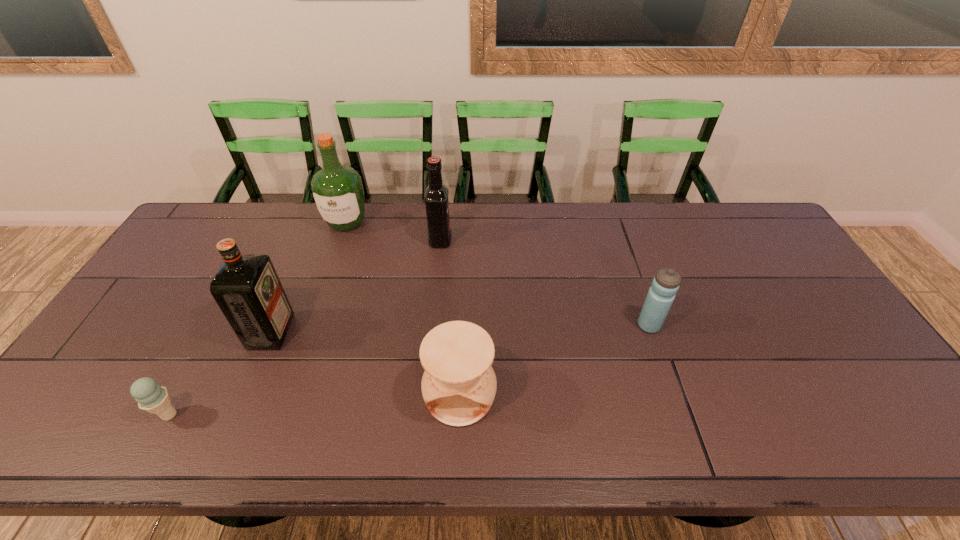
You are a GUI agent. You are given a task and a screenshot of the screen. Output one action in this format:
    pyautogui.click(x=<x>, y=<y>)
    Task: Click on the nearest liquor
    The image size is (960, 540).
    Given the screenshot: What is the action you would take?
    pyautogui.click(x=246, y=287)

In order to click on the rightmost liquor in this screenshot , I will do `click(436, 194)`.

Where is `water bottle`? This screenshot has width=960, height=540. water bottle is located at coordinates (661, 294).

At what (x,y) coordinates should I click in order to perform the action: click on pottery. Please return your answer as a coordinate pair (x, y). The height and width of the screenshot is (540, 960). Looking at the image, I should click on (459, 384).

Locate an element on the screen. the shortest object is located at coordinates (151, 397).

The height and width of the screenshot is (540, 960). I want to click on ice cream, so click(151, 397).

What are the coordinates of `vacant region located on the front label of the nearest liquor` in the screenshot? It's located at (340, 332).

You are a GUI agent. You are given a task and a screenshot of the screen. Output one action in this format:
    pyautogui.click(x=<x>, y=<y>)
    Task: Click on the vacant area situated 0.060m on the front-facing side of the rightmost liquor
    
    Given the screenshot: What is the action you would take?
    pyautogui.click(x=469, y=240)

This screenshot has width=960, height=540. I want to click on vacant region located on the right of the rightmost object, so click(x=780, y=325).

Where is `free region located at the open side of the pottery`? free region located at the open side of the pottery is located at coordinates (458, 454).